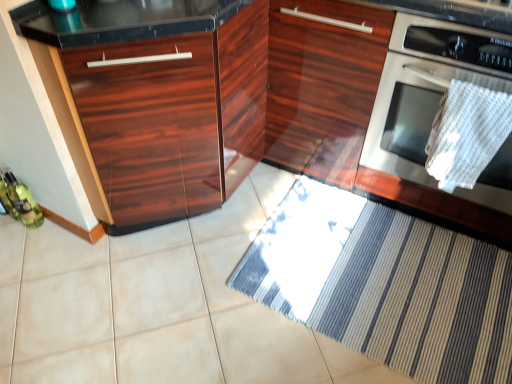
Image resolution: width=512 pixels, height=384 pixels. What are the coordinates of `vacant area that is in front of green glass bottle at lower left` in the screenshot? It's located at (25, 253).